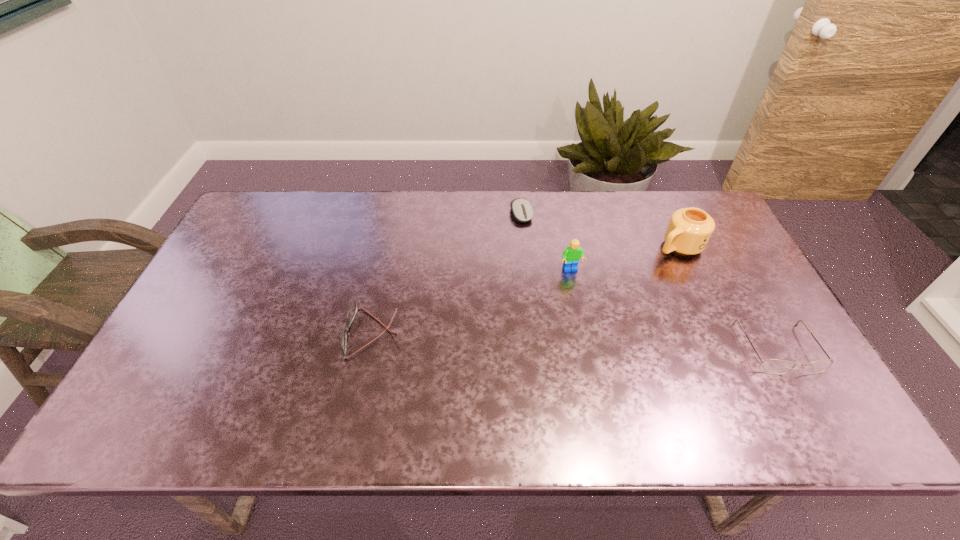
I want to click on mug that is at the far edge, so click(x=689, y=230).

You are a GUI agent. You are given a task and a screenshot of the screen. Output one action in this format:
    pyautogui.click(x=<x>, y=<y>)
    Task: Click on the object situated at the near edge
    The image size is (960, 540).
    Given the screenshot: What is the action you would take?
    pyautogui.click(x=771, y=366)

Where is `spectacles at the right edge`? The width and height of the screenshot is (960, 540). spectacles at the right edge is located at coordinates (771, 366).

You are a GUI agent. You are given a task and a screenshot of the screen. Output one action in this format:
    pyautogui.click(x=<x>, y=<y>)
    Task: Click on the mug that is at the right edge
    This screenshot has width=960, height=540.
    Given the screenshot: What is the action you would take?
    click(x=689, y=230)

At what (x,y) coordinates should I click in order to perform the action: click on object present at the far right corner. Please return your answer as a coordinate pair (x, y). The image size is (960, 540). Looking at the image, I should click on [689, 230].

The width and height of the screenshot is (960, 540). Find the location of `object present at the near right corner`. object present at the near right corner is located at coordinates (771, 366).

I want to click on free space at the far edge of the desktop, so click(467, 224).

The image size is (960, 540). Find the location of `free space at the near edge of the desktop`. free space at the near edge of the desktop is located at coordinates (655, 367).

The height and width of the screenshot is (540, 960). Find the location of `vacant space at the left edge of the desktop`. vacant space at the left edge of the desktop is located at coordinates (260, 249).

The image size is (960, 540). Identify the location of free point at the right edge. (723, 297).